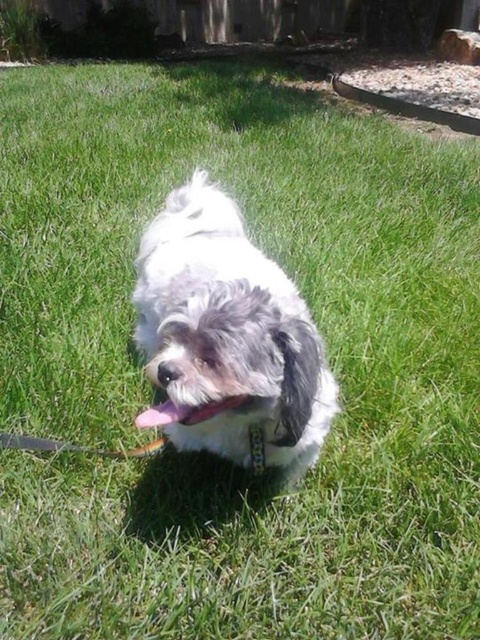
Who is more distant from viewer, (240, 298) or (255, 449)?

Point (255, 449)

Which is more to the right, white fluffy dog at center or black fabric neckband at center?

black fabric neckband at center

Is point (292, 352) closer to viewer compared to point (261, 444)?

Yes.

This screenshot has height=640, width=480. I want to click on white fluffy dog at center, so click(x=227, y=337).

Consider the image. Does white fluffy dog at center appear under pink fabric mouth at center?

Incorrect, white fluffy dog at center is not positioned below pink fabric mouth at center.

How much distance is there between white fluffy dog at center and pink fabric mouth at center?

white fluffy dog at center is 15.85 inches from pink fabric mouth at center.

Does point (173, 417) lie behind point (228, 401)?

Yes, it is.

What are the coordinates of `white fluffy dog at center` in the screenshot? It's located at (227, 337).

Is point (164, 413) in front of point (250, 432)?

Yes, it is in front of point (250, 432).

Does pink fabric mouth at center have a smaller size compared to black fabric neckband at center?

Incorrect, pink fabric mouth at center is not smaller in size than black fabric neckband at center.

Who is more distant from viewer, (208, 408) or (253, 445)?

Point (253, 445)

Identify the location of pink fabric mouth at center. This screenshot has height=640, width=480. (184, 412).